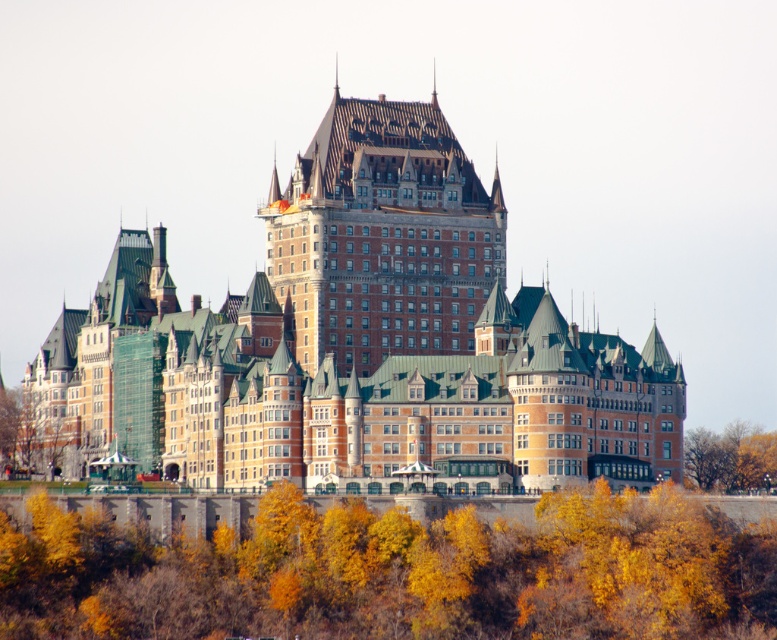
You are standing in front of the historic building and want to take a photo of the brown wooden tower at center without the yellow leafy trees at center blocking it. How should you adjust your position?

Move your position upwards because the yellow leafy trees at center are below the brown wooden tower at center, so by moving upwards, you can avoid the obstruction from the trees.